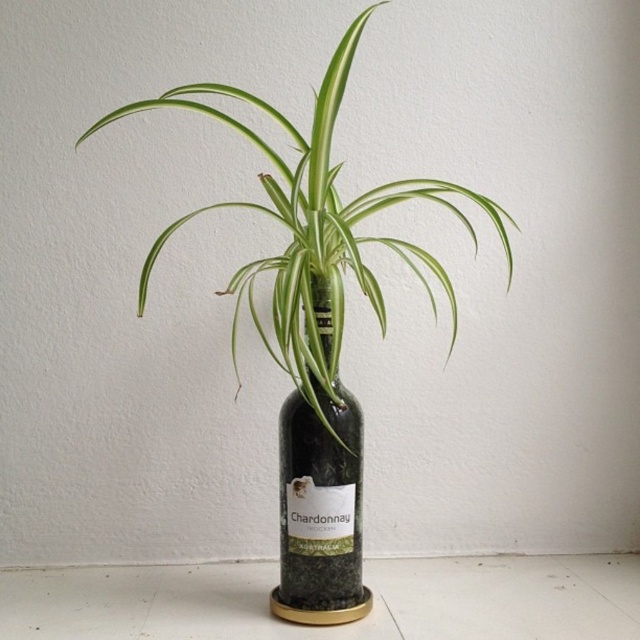
Between point (273, 154) and point (332, 552), which one is positioned in front?

Point (332, 552)

Who is more forward, (x=330, y=212) or (x=326, y=454)?

Positioned in front is point (x=330, y=212).

At what (x,y) coordinates should I click in order to perform the action: click on green leafy plant at center. Please return your answer as a coordinate pair (x, y). Looking at the image, I should click on (314, 230).